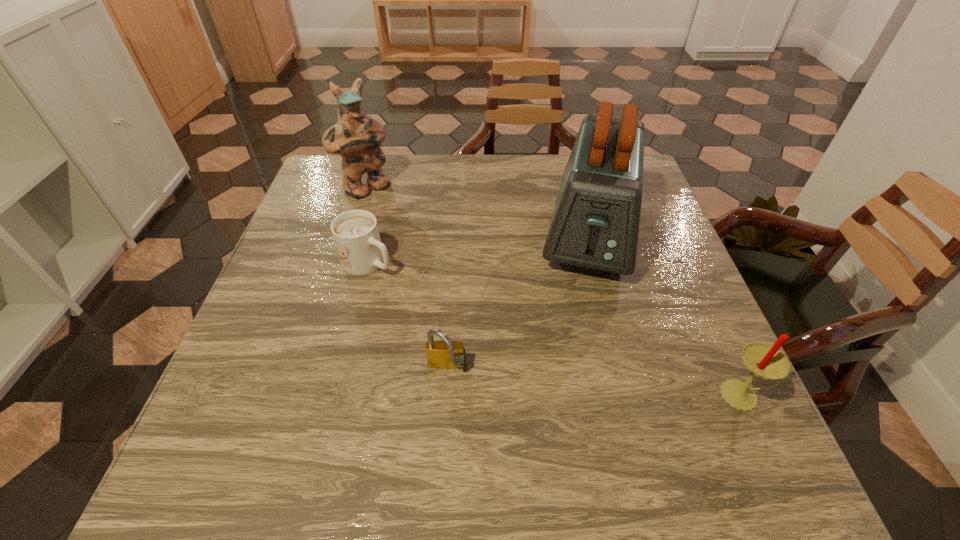
Where is `free space located on the front-facing side of the toaster`? The height and width of the screenshot is (540, 960). free space located on the front-facing side of the toaster is located at coordinates (580, 346).

Where is `free spot located 0.160m on the front-facing side of the figurine`? The width and height of the screenshot is (960, 540). free spot located 0.160m on the front-facing side of the figurine is located at coordinates (409, 231).

Locate an element on the screen. vacant space located 0.330m on the front-facing side of the figurine is located at coordinates (447, 269).

Find the location of a particular element. Image resolution: width=960 pixels, height=540 pixels. free space located 0.070m on the front-facing side of the figurine is located at coordinates (392, 213).

Identify the location of free space located 0.300m on the side with the handle of the cappuccino. This screenshot has width=960, height=540. (493, 340).

Image resolution: width=960 pixels, height=540 pixels. I want to click on vacant space located on the side with the handle of the cappuccino, so click(x=459, y=318).

At what (x,y) coordinates should I click in order to perform the action: click on vacant space located on the side with the handle of the cappuccino. Please return your answer as a coordinate pair (x, y). This screenshot has width=960, height=540. Looking at the image, I should click on [502, 345].

Where is `toaster that is at the far edge`? The height and width of the screenshot is (540, 960). toaster that is at the far edge is located at coordinates (595, 223).

This screenshot has width=960, height=540. In order to click on figurine situated at the far edge in this screenshot , I will do `click(356, 137)`.

Identify the location of padlock that is at the near edge. The height and width of the screenshot is (540, 960). pyautogui.click(x=446, y=354).